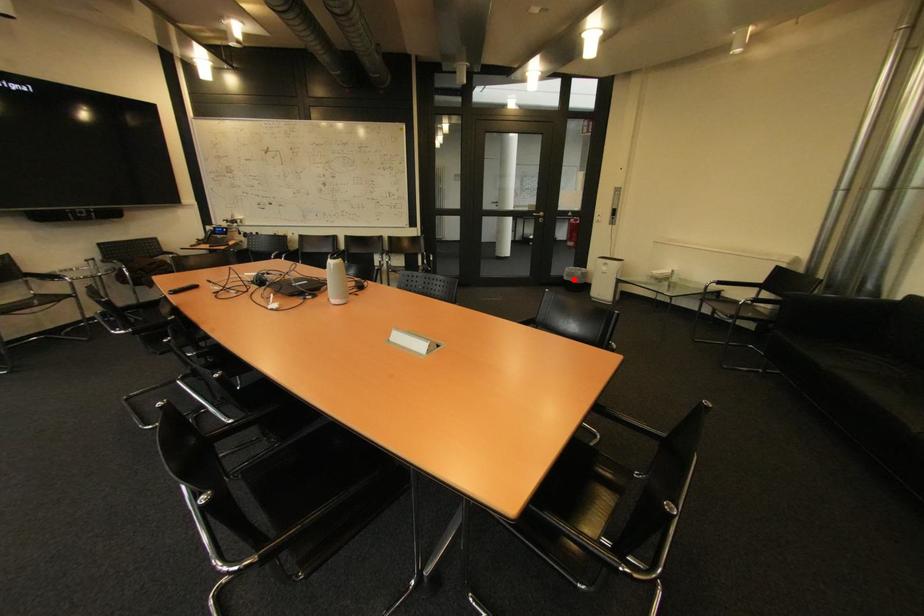
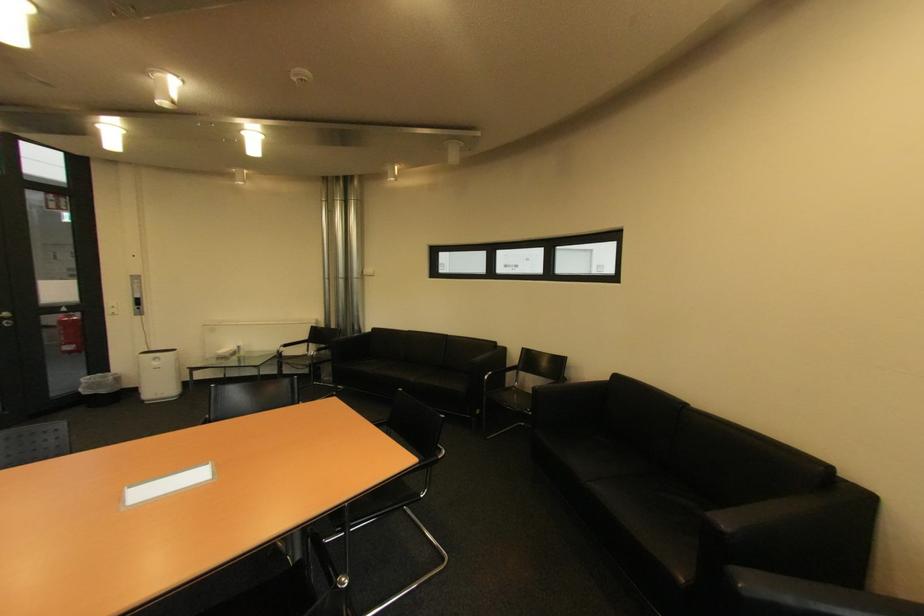
Question: A red point is marked in image1. In image2, is the corresponding 3D point closer to the camera or farther? Reply with the corresponding letter.

Choices:
 (A) The corresponding 3D point is closer.
 (B) The corresponding 3D point is farther.

Answer: (B)